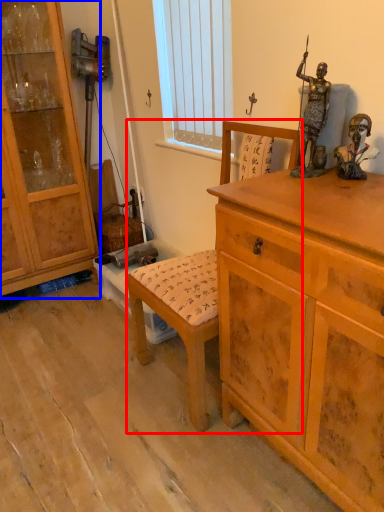
Question: Which object is further to the camera taking this photo, rocking chair (highlighted by a red box) or cabinetry (highlighted by a blue box)?

Choices:
 (A) rocking chair
 (B) cabinetry

Answer: (B)